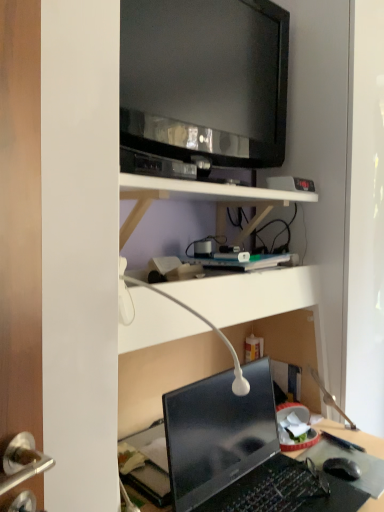
Question: Is black matte computer mouse at lower right wider or thinner than black glossy television at upper center?

Choices:
 (A) wide
 (B) thin

Answer: (A)

Question: Is black matte computer mouse at lower right in front of or behind black glossy television at upper center in the image?

Choices:
 (A) front
 (B) behind

Answer: (B)

Question: Which object is positioned closest to the glossy black laptop at lower center?

Choices:
 (A) white matte shelf at upper center
 (B) white glossy table lamp at center
 (C) black matte computer mouse at lower right
 (D) black glossy television at upper center

Answer: (B)

Question: Estimate the real-world distances between objects in this image. Which object is closer to the white matte shelf at upper center?

Choices:
 (A) white glossy table lamp at center
 (B) black matte computer mouse at lower right
 (C) glossy black laptop at lower center
 (D) black glossy television at upper center

Answer: (D)